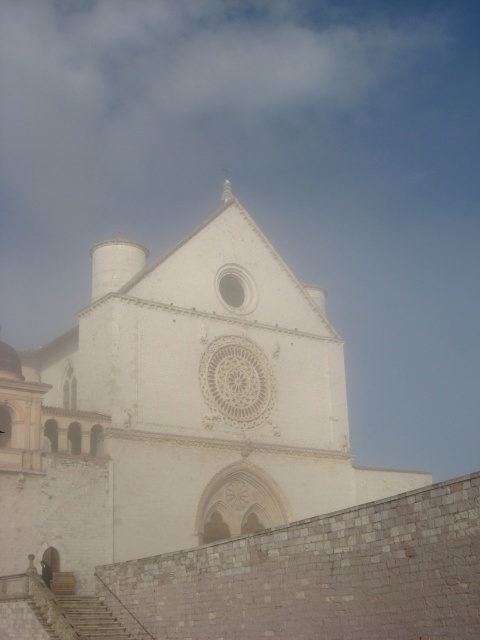
Does white stone church at center appear on the right side of white stone clock at center?

Correct, you'll find white stone church at center to the right of white stone clock at center.

Where is `white stone church at center`? The width and height of the screenshot is (480, 640). white stone church at center is located at coordinates point(212,470).

Is white stone clock at center below white stone spire at upper center?

Yes.

Does white stone clock at center have a lesser width compared to white stone spire at upper center?

Yes, white stone clock at center is thinner than white stone spire at upper center.

What are the coordinates of `white stone clock at center` in the screenshot? It's located at (237, 380).

You are a GUI agent. You are given a task and a screenshot of the screen. Output one action in this format:
    pyautogui.click(x=<x>, y=<y>)
    Task: Click on the white stone clock at center
    
    Given the screenshot: What is the action you would take?
    point(237,380)

Looking at this image, which is more to the left, white stone church at center or white stone spire at upper center?

white stone spire at upper center

Which is behind, point (134, 552) or point (226, 177)?

The point (226, 177) is behind.

Does point (165, 285) come in front of point (225, 202)?

Yes, it is in front of point (225, 202).

Identify the location of white stone church at center. (212, 470).